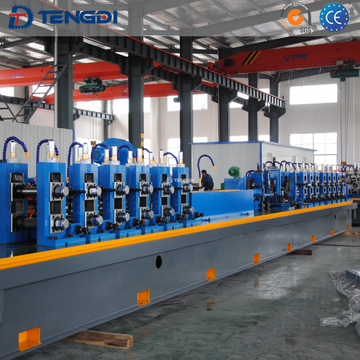
Image resolution: width=360 pixels, height=360 pixels. What are the coordinates of `window` in the screenshot? It's located at (327, 144), (306, 137), (324, 158).